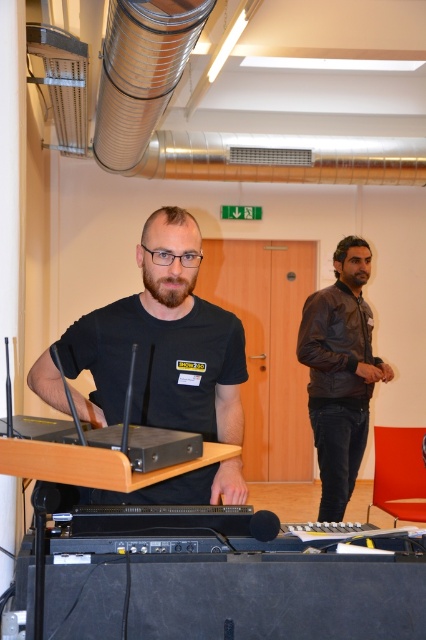
Consider the image. Does black matte t-shirt at center appear on the left side of leather jacket at right?

Indeed, black matte t-shirt at center is positioned on the left side of leather jacket at right.

This screenshot has height=640, width=426. Describe the element at coordinates (163, 342) in the screenshot. I see `black matte t-shirt at center` at that location.

Find the location of `black matte t-shirt at center`. black matte t-shirt at center is located at coordinates (163, 342).

Who is positioned more to the left, leather jacket at right or black plastic laptop at center?

Positioned to the left is black plastic laptop at center.

Who is lower down, leather jacket at right or black plastic laptop at center?

leather jacket at right is lower down.

Is point (321, 301) in front of point (166, 451)?

No, (321, 301) is further to viewer.

Where is `leather jacket at right`? This screenshot has height=640, width=426. leather jacket at right is located at coordinates (339, 372).

Who is more forward, [209,468] or [131,353]?

Positioned in front is point [131,353].

The width and height of the screenshot is (426, 640). I want to click on black matte t-shirt at center, so click(163, 342).

Does point (169, 499) come in front of point (129, 433)?

No, (169, 499) is further to viewer.

The height and width of the screenshot is (640, 426). Identify the location of black matte t-shirt at center. (163, 342).